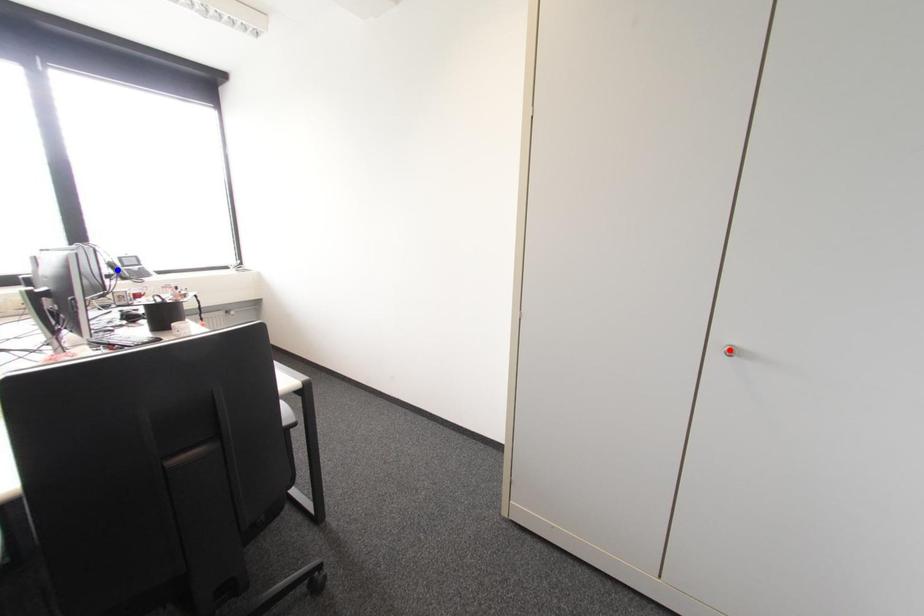
Question: Which of the two points in the image is closer to the camera?

Choices:
 (A) Blue point is closer.
 (B) Red point is closer.

Answer: (B)